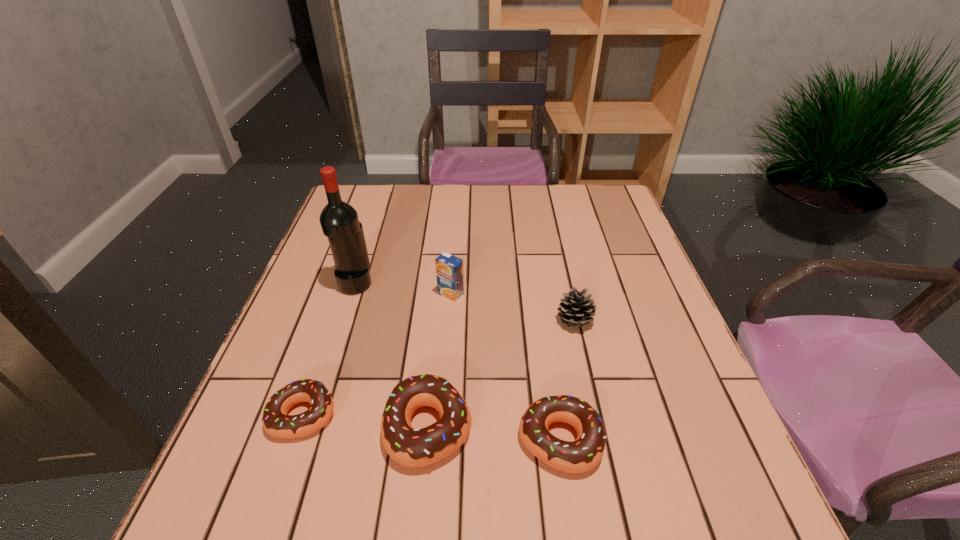
I want to click on the shortest object, so click(x=275, y=421).

I want to click on the shortest doughnut, so click(x=275, y=421).

Identify the location of the second doughnut from right to left. (410, 447).

Locate an element on the screen. The height and width of the screenshot is (540, 960). the second shortest doughnut is located at coordinates (583, 454).

Where is `the fifth tallest object`? the fifth tallest object is located at coordinates (583, 454).

At what (x,y) coordinates should I click in order to perform the action: click on orange_juice. Please return your answer as a coordinate pair (x, y). The width and height of the screenshot is (960, 540). Looking at the image, I should click on (449, 269).

Locate an element on the screen. the third farthest object is located at coordinates (576, 310).

Locate an element on the screen. the fourth shortest object is located at coordinates (576, 310).

At what (x,y) coordinates should I click in order to perform the action: click on wine bottle. Please return your answer as a coordinate pair (x, y). Looking at the image, I should click on (339, 221).

Locate an element on the screen. This screenshot has width=960, height=540. free location located 0.380m on the right of the shortest object is located at coordinates (539, 414).